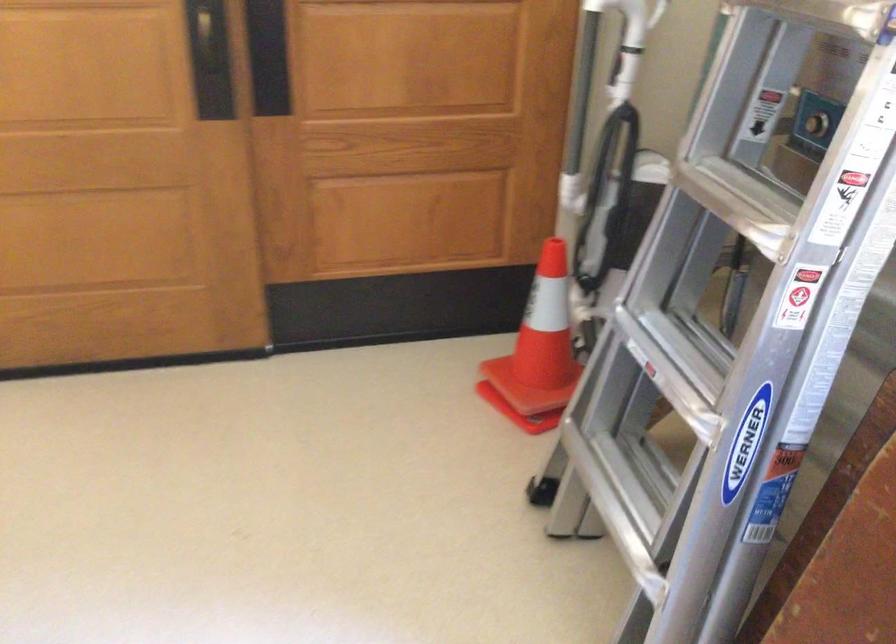
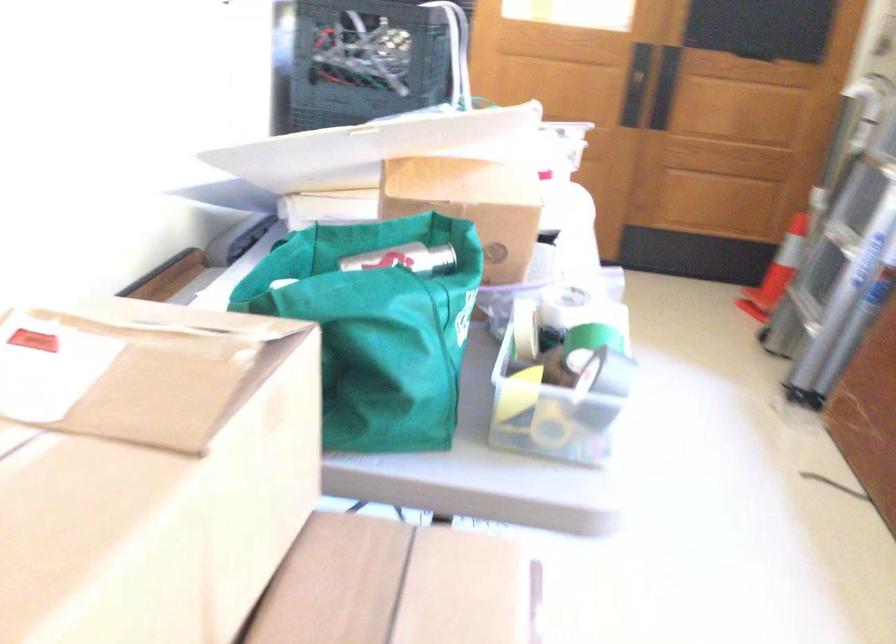
Question: What movement of the cameraman would produce the second image?

Choices:
 (A) Left
 (B) Right
 (C) Forward
 (D) Backward

Answer: (D)